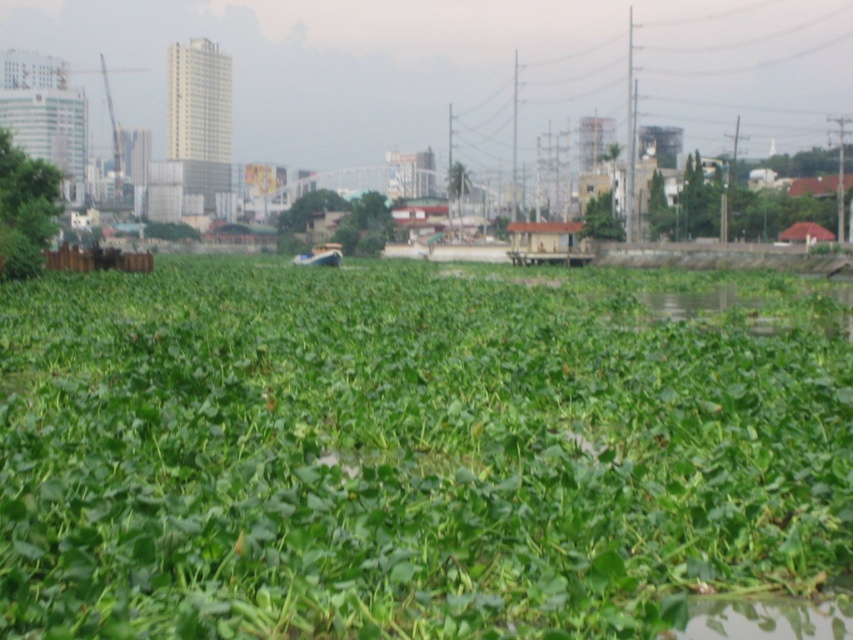
You are a gardener who needs to water both the green leafy plants at center and the green leafy plant at left. You have a watering can that can hold enough water for 15 meters of travel. Can you water both plants without needing to refill your watering can?

The distance between the green leafy plants at center and the green leafy plant at left is 14.86 meters. Since your watering can can hold enough water for 15 meters of travel, you can water both plants without needing to refill your watering can.

You are a small frog trying to jump from the green leafy plant at left to the green leafy plants at center. Can you make the jump without falling into the water?

The green leafy plants at center might be wider than green leafy plant at left, so the distance between them could be too large for the frog to jump safely. It might fall into the water.